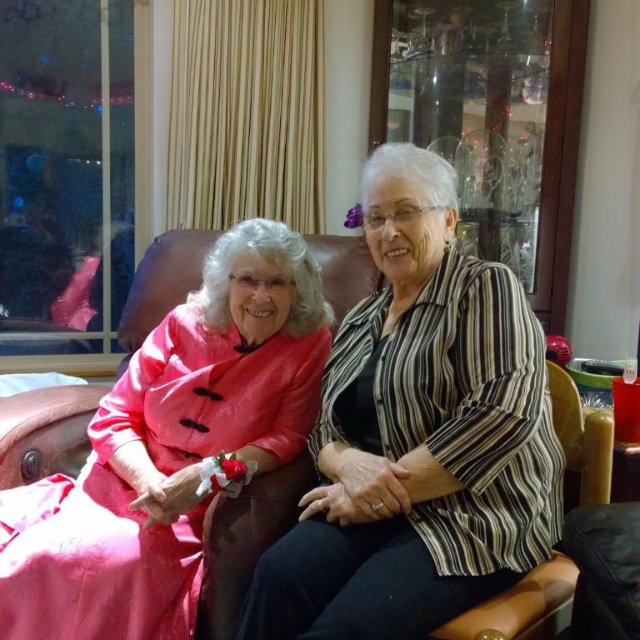
Question: Is striped fabric shirt at center positioned at the back of matte pink dress at left?

Choices:
 (A) no
 (B) yes

Answer: (A)

Question: Among these points, which one is farthest from the camera?

Choices:
 (A) (451, 508)
 (B) (205, 360)

Answer: (B)

Question: Among these objects, which one is farthest from the camera?

Choices:
 (A) striped fabric shirt at center
 (B) matte pink dress at left

Answer: (B)

Question: Is striped fabric shirt at center positioned at the back of matte pink dress at left?

Choices:
 (A) no
 (B) yes

Answer: (A)

Question: Is striped fabric shirt at center positioned at the back of matte pink dress at left?

Choices:
 (A) no
 (B) yes

Answer: (A)